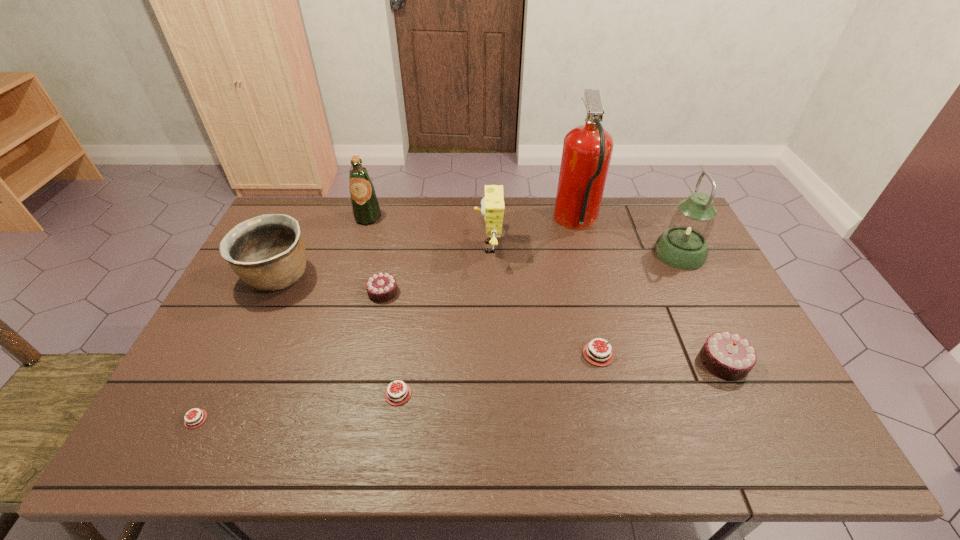
The width and height of the screenshot is (960, 540). Find the location of `empty space that is in between the second red chocolate cake from right to left and the farthest chocolate cake`. empty space that is in between the second red chocolate cake from right to left and the farthest chocolate cake is located at coordinates (391, 343).

At what (x,y) coordinates should I click in order to perform the action: click on free point between the left chocolate chocolate cake and the fire extinguisher. Please return your answer as a coordinate pair (x, y). Looking at the image, I should click on pyautogui.click(x=480, y=258).

You are a GUI agent. You are given a task and a screenshot of the screen. Output one action in this format:
    pyautogui.click(x=<x>, y=<y>)
    Task: Click on the free space between the second tallest object and the rightmost chocolate cake
    The width and height of the screenshot is (960, 540).
    Given the screenshot: What is the action you would take?
    pyautogui.click(x=702, y=307)

Identify the location of vacant area that lies between the fifth object from right to left and the farther chocolate chocolate cake. (436, 270).

The height and width of the screenshot is (540, 960). Identify the location of free space between the second tallest chocolate cake and the lantern. (531, 273).

Identify the location of free space between the tallest object and the green olive oil. The height and width of the screenshot is (540, 960). (472, 220).

Identify the location of vacant space that's between the lantern and the second red chocolate cake from right to left. The width and height of the screenshot is (960, 540). (539, 323).

At what (x,y) coordinates should I click in order to perform the action: click on empty location between the rightmost chocolate cake and the yellow sponge. Please return your answer as a coordinate pair (x, y). The image size is (960, 540). Looking at the image, I should click on (606, 305).

The image size is (960, 540). I want to click on empty location between the olive oil and the fourth tallest chocolate cake, so click(383, 306).

Identify the location of object that is the fifth closest to the second chocolate cake from right to left. (397, 395).